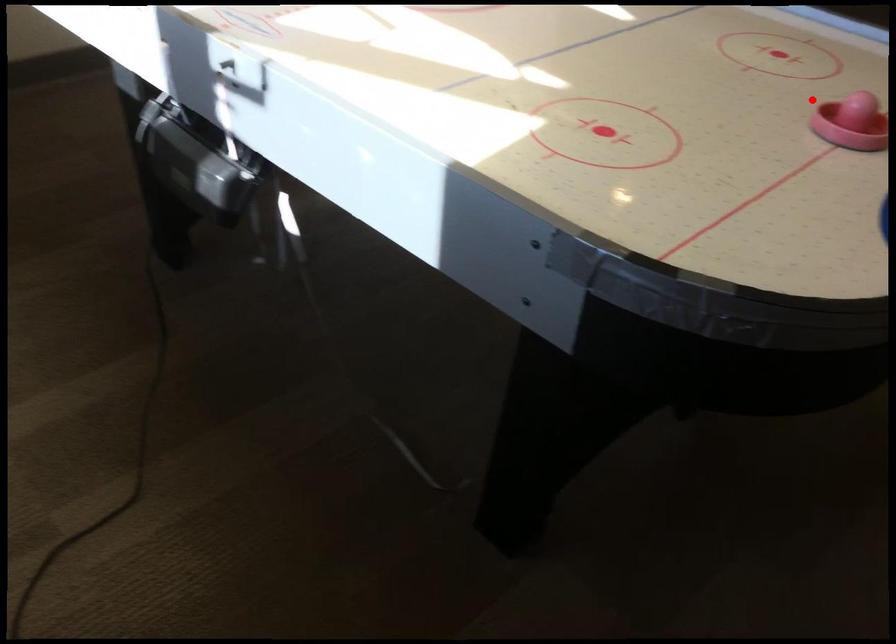
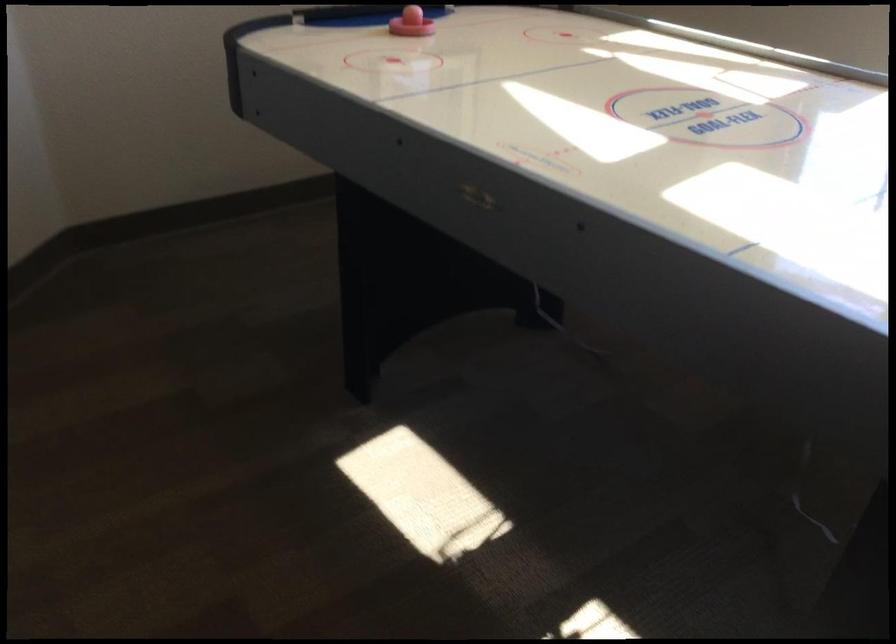
Question: I am providing you with two images of the same scene from different viewpoints. Given a red point in image1, look at the same physical point in image2. Is it:

Choices:
 (A) Closer to the viewpoint
 (B) Farther from the viewpoint

Answer: (B)